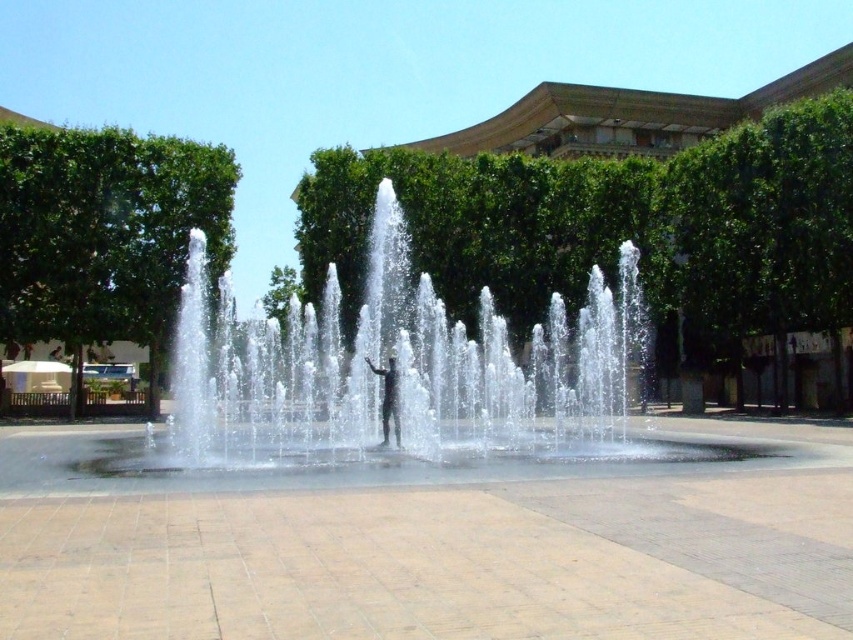
Question: Is clear water at center below black matte person at center?

Choices:
 (A) yes
 (B) no

Answer: (B)

Question: Which point is farther from the camera taking this photo?

Choices:
 (A) (398, 426)
 (B) (247, 464)

Answer: (A)

Question: Is clear water at center bigger than black matte person at center?

Choices:
 (A) no
 (B) yes

Answer: (B)

Question: Among these objects, which one is farthest from the camera?

Choices:
 (A) black matte person at center
 (B) clear water at center

Answer: (A)

Question: Can you confirm if clear water at center is smaller than black matte person at center?

Choices:
 (A) no
 (B) yes

Answer: (A)